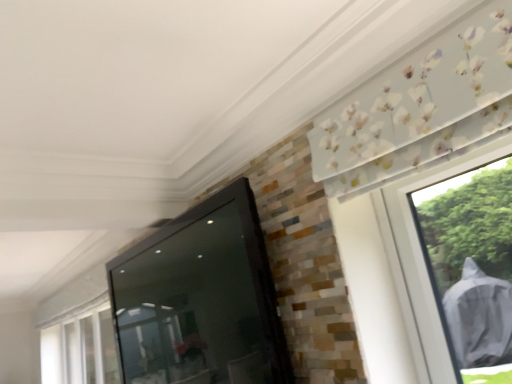
In order to face transparent plastic window at lower left, should I rotate leftwards or rightwards?

To align with it, rotate left about 21.625°.

This screenshot has height=384, width=512. I want to click on transparent plastic window at lower left, so click(81, 349).

This screenshot has height=384, width=512. Describe the element at coordinates (81, 349) in the screenshot. I see `transparent plastic window at lower left` at that location.

Image resolution: width=512 pixels, height=384 pixels. What do you see at coordinates (200, 299) in the screenshot?
I see `black glossy screen door at center` at bounding box center [200, 299].

At what (x,y) coordinates should I click in order to perform the action: click on black glossy screen door at center. Please return your answer as a coordinate pair (x, y). Looking at the image, I should click on (200, 299).

Image resolution: width=512 pixels, height=384 pixels. I want to click on transparent plastic window at lower left, so click(81, 349).

Is black glossy screen door at center to the left or to the right of transparent plastic window at lower left in the image?

black glossy screen door at center is positioned on transparent plastic window at lower left's right side.

Which object is further away from the camera, black glossy screen door at center or transparent plastic window at lower left?

transparent plastic window at lower left is more distant.

Between point (183, 341) and point (75, 367), which one is positioned behind?

The point (75, 367) is behind.

From the image's perspective, which is above, black glossy screen door at center or transparent plastic window at lower left?

black glossy screen door at center.

From a real-world perspective, is black glossy screen door at center over transparent plastic window at lower left?

Indeed, from a real-world perspective, black glossy screen door at center stands above transparent plastic window at lower left.

Looking at their sizes, would you say black glossy screen door at center is wider or thinner than transparent plastic window at lower left?

black glossy screen door at center is wider than transparent plastic window at lower left.

Who is taller, black glossy screen door at center or transparent plastic window at lower left?

black glossy screen door at center.

Between black glossy screen door at center and transparent plastic window at lower left, which one has larger size?

With larger size is black glossy screen door at center.

Is black glossy screen door at center inside the boundaries of transparent plastic window at lower left, or outside?

black glossy screen door at center exists outside the volume of transparent plastic window at lower left.

Is black glossy screen door at center positioned far away from transparent plastic window at lower left?

Yes, black glossy screen door at center and transparent plastic window at lower left are quite far apart.

Could you tell me if black glossy screen door at center is turned towards transparent plastic window at lower left?

No, black glossy screen door at center is not turned towards transparent plastic window at lower left.

Can you tell me how much black glossy screen door at center and transparent plastic window at lower left differ in facing direction?

The facing directions of black glossy screen door at center and transparent plastic window at lower left are 1.11 degrees apart.

Where is `window lying below the black glossy screen door at center (from the image's perspective)`? window lying below the black glossy screen door at center (from the image's perspective) is located at coordinates (81, 349).

In the scene shown: Visually, is transparent plastic window at lower left positioned to the left or to the right of black glossy screen door at center?

transparent plastic window at lower left is positioned on black glossy screen door at center's left side.

Relative to black glossy screen door at center, is transparent plastic window at lower left in front or behind?

In the image, transparent plastic window at lower left appears behind black glossy screen door at center.

Is point (57, 329) positioned before point (208, 361)?

No, it is behind (208, 361).

From the image's perspective, who appears lower, transparent plastic window at lower left or black glossy screen door at center?

transparent plastic window at lower left, from the image's perspective.

From a real-world perspective, is transparent plastic window at lower left under black glossy screen door at center?

Yes, from a real-world perspective, transparent plastic window at lower left is below black glossy screen door at center.

Can you confirm if transparent plastic window at lower left is wider than black glossy screen door at center?

In fact, transparent plastic window at lower left might be narrower than black glossy screen door at center.

Based on the photo, which of these two, transparent plastic window at lower left or black glossy screen door at center, stands shorter?

With less height is transparent plastic window at lower left.

Based on the photo, considering the sizes of transparent plastic window at lower left and black glossy screen door at center in the image, is transparent plastic window at lower left bigger or smaller than black glossy screen door at center?

transparent plastic window at lower left is smaller than black glossy screen door at center.

Would you say transparent plastic window at lower left is outside black glossy screen door at center?

Yes, transparent plastic window at lower left is not within black glossy screen door at center.

Is transparent plastic window at lower left next to black glossy screen door at center?

No, transparent plastic window at lower left is not beside black glossy screen door at center.

Could you tell me if transparent plastic window at lower left is turned towards black glossy screen door at center?

No, transparent plastic window at lower left is not aimed at black glossy screen door at center.

Can you tell me how much transparent plastic window at lower left and black glossy screen door at center differ in facing direction?

There is a 1.11-degree angle between the facing directions of transparent plastic window at lower left and black glossy screen door at center.

What are the coordinates of `window beneath the black glossy screen door at center (from a real-world perspective)` in the screenshot? It's located at (81, 349).

Where is `window on the left of black glossy screen door at center`? The width and height of the screenshot is (512, 384). window on the left of black glossy screen door at center is located at coordinates (81, 349).

What are the coordinates of `screen door that is above the transparent plastic window at lower left (from a real-world perspective)` in the screenshot? It's located at (200, 299).